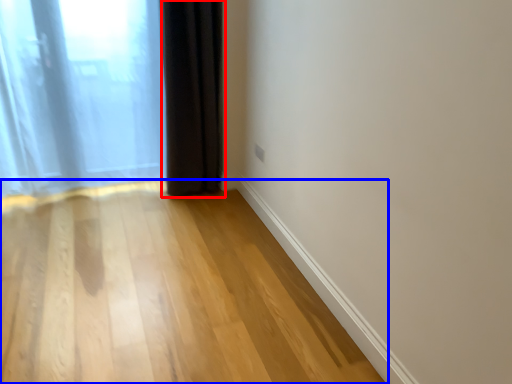
Question: Which point is closer to the camera, curtain (highlighted by a red box) or corridor (highlighted by a blue box)?

Choices:
 (A) curtain
 (B) corridor

Answer: (B)